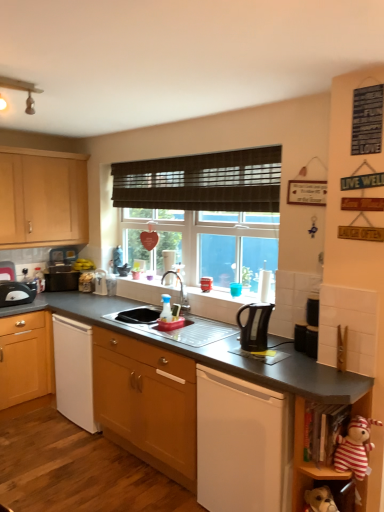
Identify the location of vacant space situated above wooden cabinet at center, the second cabinetry viewed from the top (from a real-world perspective). (160, 324).